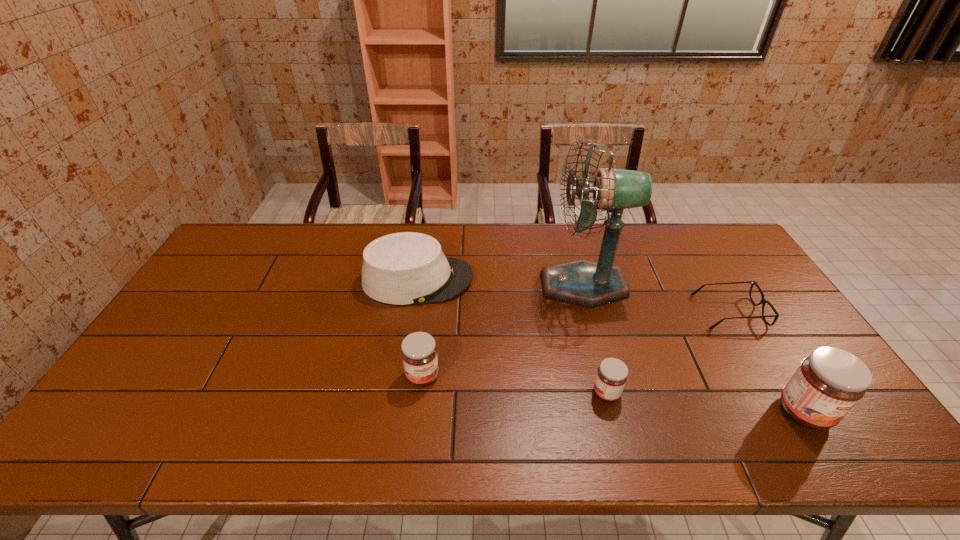
Locate an element on the screen. This screenshot has width=960, height=540. empty space between the rightmost jam and the spectacles is located at coordinates tap(767, 362).

Locate an element on the screen. free spot between the shortest jam and the second shortest jam is located at coordinates (515, 384).

Locate an element on the screen. This screenshot has height=540, width=960. vacant region between the shortest object and the rightmost jam is located at coordinates (767, 362).

Where is `free space between the hat and the shortest jam`? The image size is (960, 540). free space between the hat and the shortest jam is located at coordinates (512, 336).

At what (x,y) coordinates should I click in order to perform the action: click on empty location between the shortest jam and the spectacles. Please return your answer as a coordinate pair (x, y). Looking at the image, I should click on (668, 353).

What are the coordinates of `blank region between the leftmost jam and the fifth tallest object` in the screenshot? It's located at [x=515, y=384].

Locate an element on the screen. Image resolution: width=960 pixels, height=540 pixels. free spot between the shortest jam and the fifth shortest object is located at coordinates (706, 402).

Identify which object is the second closest to the fan. Please provide its 2D coordinates. Your answer should be formatted as a tuple, i.e. [(x, y)], where the tuple contains the x and y coordinates of a point satisfying the conditions above.

[(404, 268)]

The image size is (960, 540). Find the location of `object that is the third closest to the tallest jam`. object that is the third closest to the tallest jam is located at coordinates (612, 374).

Where is `jam object that ranks as the closest to the hat`? jam object that ranks as the closest to the hat is located at coordinates (419, 355).